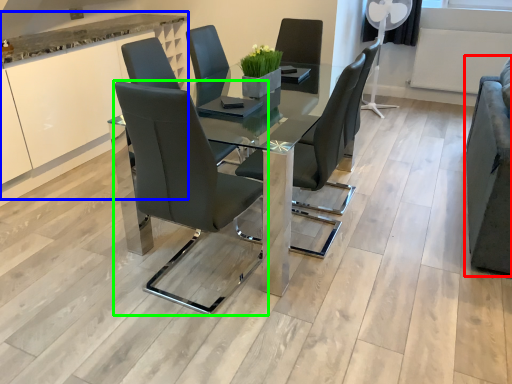
Question: Which object is positioned farthest from armchair (highlighted by a red box)? Select from cabinetry (highlighted by a blue box) and chair (highlighted by a green box).

Choices:
 (A) cabinetry
 (B) chair

Answer: (A)